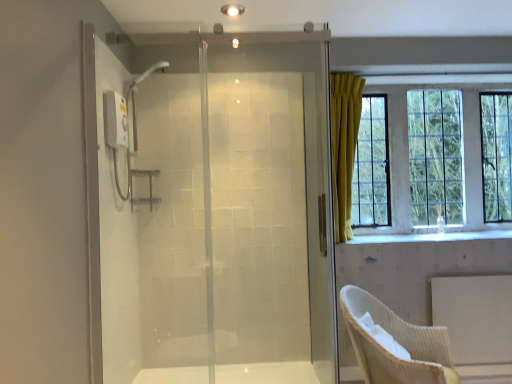
Question: Can we say yellow fabric curtain at upper right lies outside woven beige chair at lower right?

Choices:
 (A) no
 (B) yes

Answer: (B)

Question: Can you confirm if yellow fabric curtain at upper right is shorter than woven beige chair at lower right?

Choices:
 (A) yes
 (B) no

Answer: (B)

Question: From the image's perspective, is yellow fabric curtain at upper right under woven beige chair at lower right?

Choices:
 (A) yes
 (B) no

Answer: (B)

Question: Can you confirm if yellow fabric curtain at upper right is bigger than woven beige chair at lower right?

Choices:
 (A) no
 (B) yes

Answer: (A)

Question: Is yellow fabric curtain at upper right closer to camera compared to woven beige chair at lower right?

Choices:
 (A) no
 (B) yes

Answer: (A)

Question: Is point (396, 157) positioned closer to the camera than point (310, 152)?

Choices:
 (A) farther
 (B) closer

Answer: (A)

Question: In terms of size, does yellow fabric curtain at upper right appear bigger or smaller than transparent glass shower door at center?

Choices:
 (A) small
 (B) big

Answer: (B)

Question: From the image's perspective, is yellow fabric curtain at upper right positioned above or below transparent glass shower door at center?

Choices:
 (A) below
 (B) above

Answer: (B)

Question: From a real-world perspective, is yellow fabric curtain at upper right above or below transparent glass shower door at center?

Choices:
 (A) below
 (B) above

Answer: (B)

Question: Relative to transparent glass shower door at center, is woven beige chair at lower right in front or behind?

Choices:
 (A) behind
 (B) front

Answer: (B)

Question: From a real-world perspective, is woven beige chair at lower right positioned above or below transparent glass shower door at center?

Choices:
 (A) above
 (B) below

Answer: (B)

Question: Looking at the image, does woven beige chair at lower right seem bigger or smaller compared to transparent glass shower door at center?

Choices:
 (A) big
 (B) small

Answer: (A)

Question: Is point (374, 375) positioned closer to the camera than point (184, 228)?

Choices:
 (A) farther
 (B) closer

Answer: (B)

Question: From a real-world perspective, is yellow fabric curtain at upper right physically located above or below woven beige chair at lower right?

Choices:
 (A) above
 (B) below

Answer: (A)

Question: From the image's perspective, is yellow fabric curtain at upper right positioned above or below woven beige chair at lower right?

Choices:
 (A) below
 (B) above

Answer: (B)